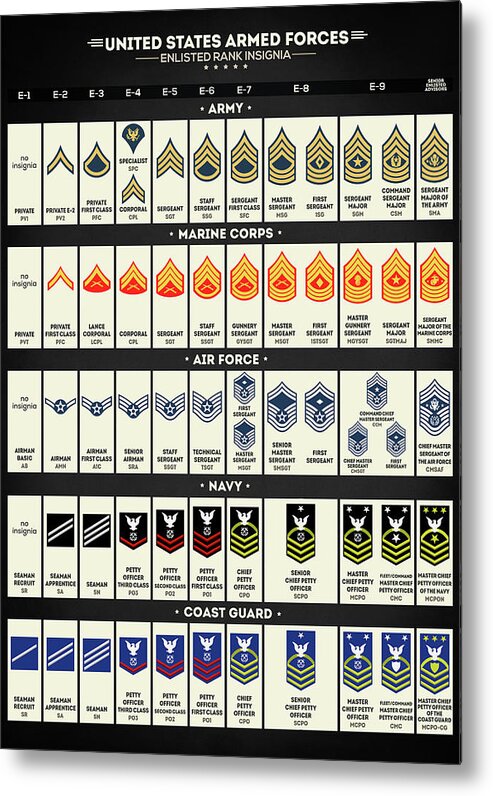
Where is `military insignia poster`? military insignia poster is located at coordinates (226, 431).